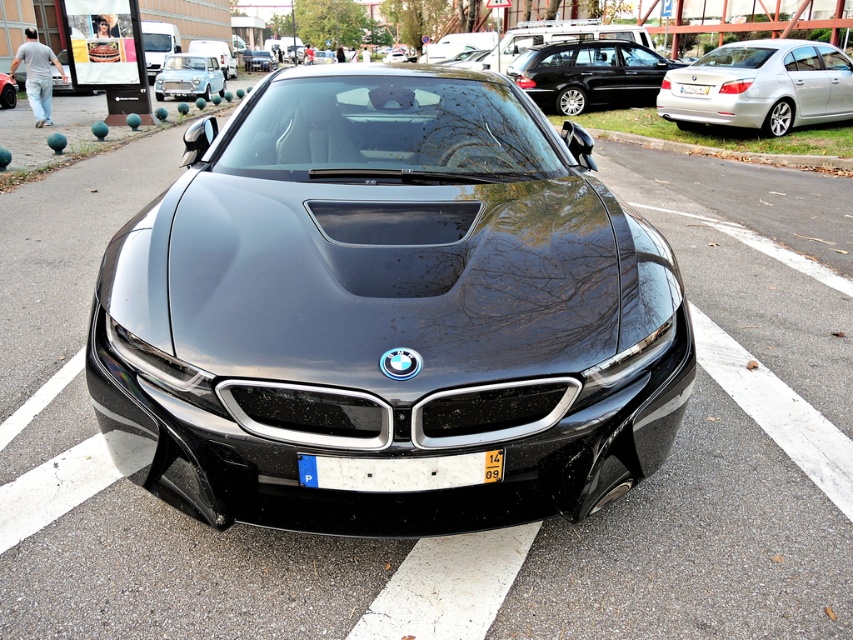
Does white plastic license plate at center have a lesser height compared to metallic silver sedan at center?

Yes, white plastic license plate at center is shorter than metallic silver sedan at center.

Is white plastic license plate at center above metallic silver sedan at center?

No.

Which is in front, point (383, 465) or point (258, 60)?

Positioned in front is point (383, 465).

The width and height of the screenshot is (853, 640). I want to click on white plastic license plate at center, so click(399, 472).

Does shiny black sedan at center lie in front of light blue metallic sedan at upper left?

That is True.

Which of these two, shiny black sedan at center or light blue metallic sedan at upper left, stands taller?

Standing taller between the two is light blue metallic sedan at upper left.

Measure the distance between shiny black sedan at center and camera.

A distance of 15.88 meters exists between shiny black sedan at center and camera.

Where is `shiny black sedan at center`? This screenshot has height=640, width=853. shiny black sedan at center is located at coordinates (589, 74).

Who is taller, light blue metallic sedan at upper left or yellow matte license plate at center?

Standing taller between the two is light blue metallic sedan at upper left.

Is light blue metallic sedan at upper left shorter than yellow matte license plate at center?

Incorrect, light blue metallic sedan at upper left's height does not fall short of yellow matte license plate at center's.

Where is `light blue metallic sedan at upper left`? This screenshot has width=853, height=640. light blue metallic sedan at upper left is located at coordinates tap(189, 76).